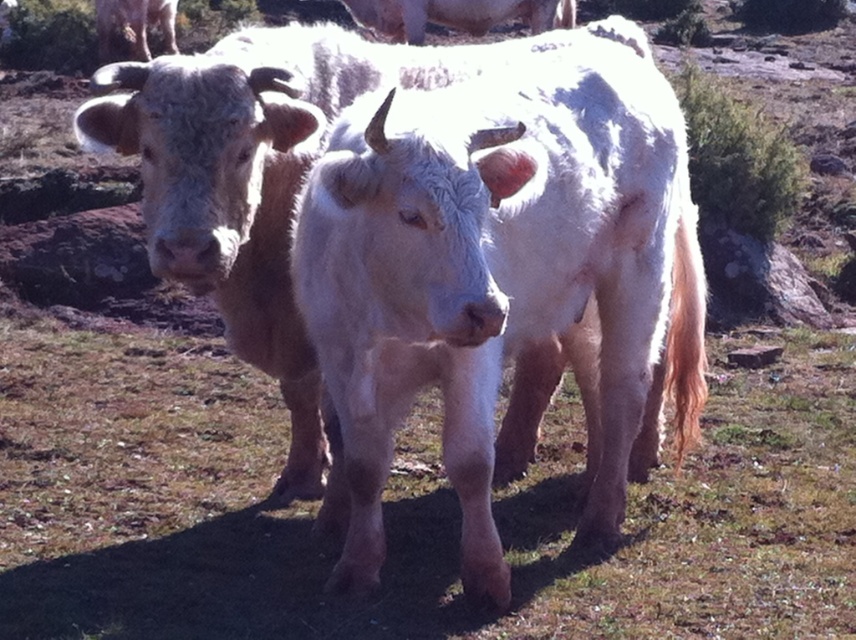
Question: Can you confirm if green grass at center is positioned below white woolly cow at center?

Choices:
 (A) no
 (B) yes

Answer: (B)

Question: Can you confirm if green grass at center is positioned above white woolly cow at center?

Choices:
 (A) yes
 (B) no

Answer: (B)

Question: Among these objects, which one is nearest to the camera?

Choices:
 (A) white woolly cow at center
 (B) green grass at center

Answer: (A)

Question: Does green grass at center have a larger size compared to white woolly cow at center?

Choices:
 (A) no
 (B) yes

Answer: (B)

Question: Which point appears closest to the camera in this image?

Choices:
 (A) (489, 588)
 (B) (682, 579)

Answer: (A)